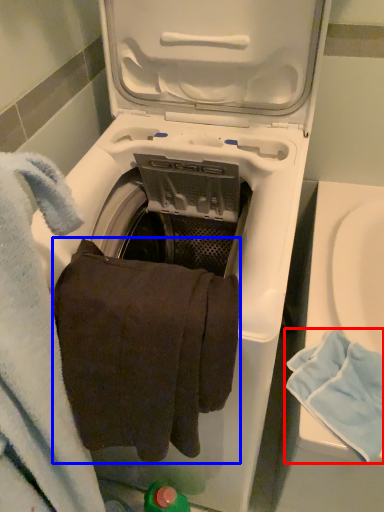
Question: Which object appears closest to the camera in this image, bath towel (highlighted by a red box) or bath towel (highlighted by a blue box)?

Choices:
 (A) bath towel
 (B) bath towel

Answer: (B)